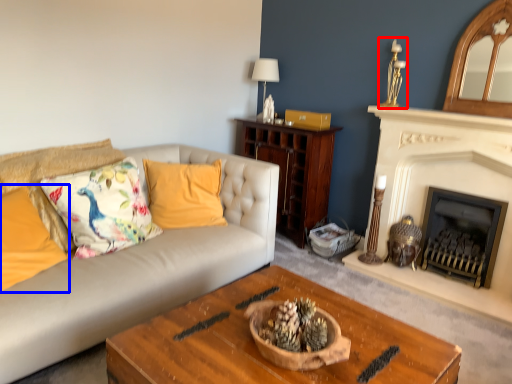
Question: Which object is closer to the camera taking this photo, candle holder (highlighted by a red box) or pillow (highlighted by a blue box)?

Choices:
 (A) candle holder
 (B) pillow

Answer: (B)